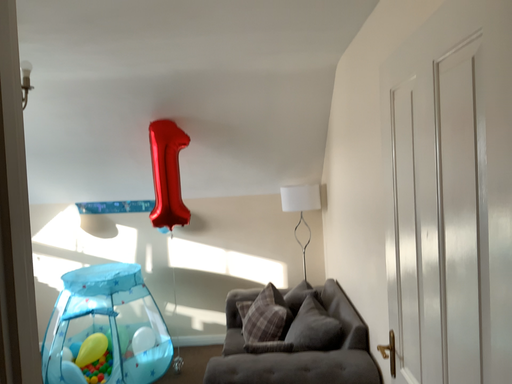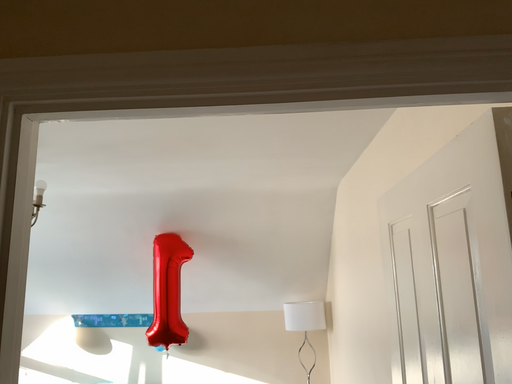
Question: Which way did the camera rotate in the video?

Choices:
 (A) rotated downward
 (B) rotated upward

Answer: (B)